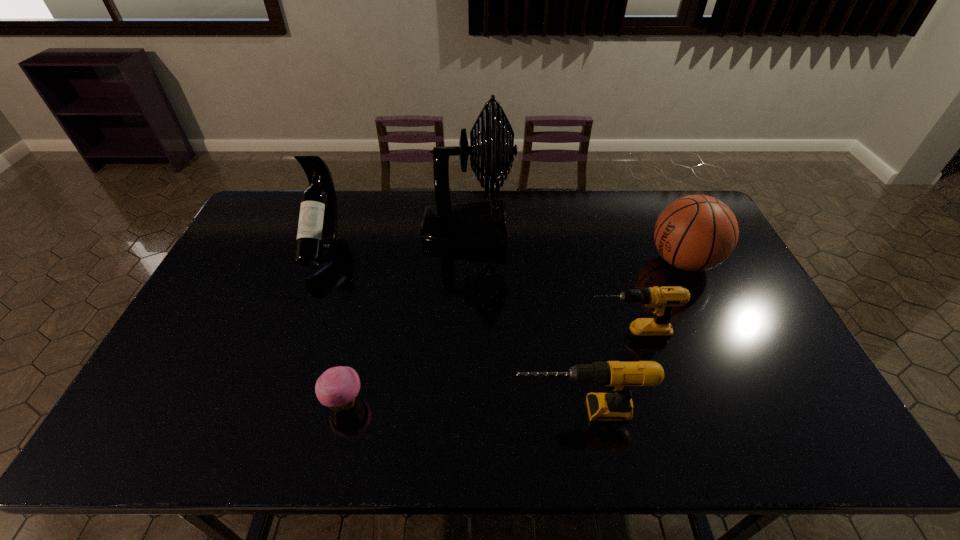
Where is `blank space located 0.080m on the stand of the second tallest object`? This screenshot has width=960, height=540. blank space located 0.080m on the stand of the second tallest object is located at coordinates (303, 299).

In order to click on vacant space located 0.340m on the surface of the rightmost object near the brand logo in this screenshot , I will do (x=542, y=261).

The width and height of the screenshot is (960, 540). In order to click on free space located 0.240m on the surface of the rightmost object near the brand logo in this screenshot , I will do `click(573, 261)`.

Locate an element on the screen. The width and height of the screenshot is (960, 540). vacant space located 0.060m on the surface of the rightmost object near the brand logo is located at coordinates (629, 261).

Locate an element on the screen. Image resolution: width=960 pixels, height=540 pixels. vacant space located 0.160m at the tip of the farther drill is located at coordinates (526, 335).

You are a GUI agent. You are given a task and a screenshot of the screen. Output one action in this format:
    pyautogui.click(x=<x>, y=<y>)
    Task: Click on the free region located 0.200m at the tip of the farther drill
    
    Given the screenshot: What is the action you would take?
    pyautogui.click(x=512, y=335)

Where is `free spot located at the tip of the farther drill`? free spot located at the tip of the farther drill is located at coordinates (475, 335).

The width and height of the screenshot is (960, 540). What are the coordinates of `vacant region located 0.360m on the handle side of the nearer drill` in the screenshot? It's located at (363, 410).

This screenshot has height=540, width=960. Find the location of `free space located 0.250m on the handle side of the nearer drill`. free space located 0.250m on the handle side of the nearer drill is located at coordinates (409, 410).

Where is `blank space located 0.130m on the handle side of the nearer drill`? blank space located 0.130m on the handle side of the nearer drill is located at coordinates (459, 410).